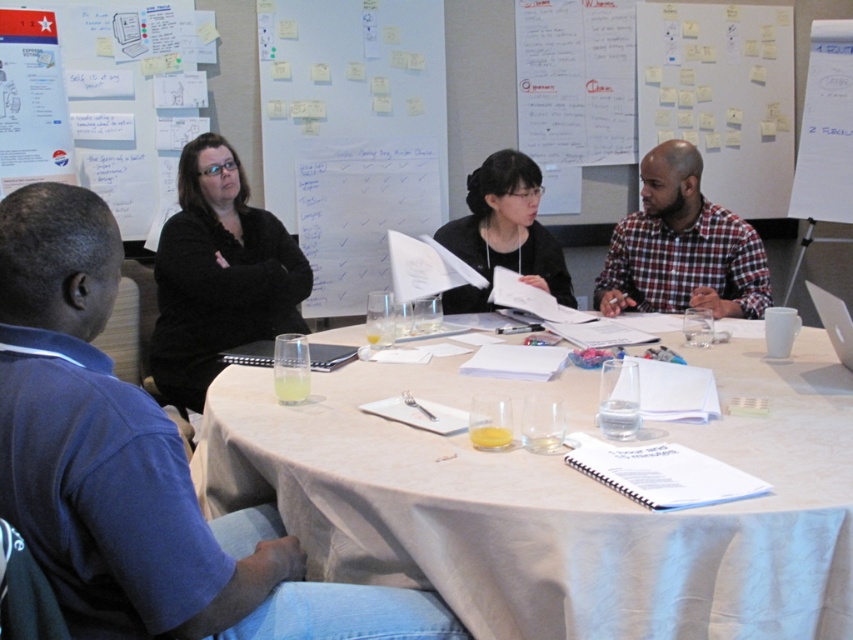
You are a photographer trying to capture a candid shot of the two people in the meeting. You want to frame the shot so that the black matte shirt at upper left and the plaid shirt at center are both visible. Based on their positions, which one should be placed on the left side of the photo?

The black matte shirt at upper left should be placed on the left side of the photo because it is to the left of the plaid shirt at center.

You are organizing a team meeting and need to ensure everyone has enough space. The blue shirt at left and the black matte shirt at upper left are seated at the table. Which participant requires more space due to their clothing size?

The blue shirt at left requires more space because it is larger in size than the black matte shirt at upper left.